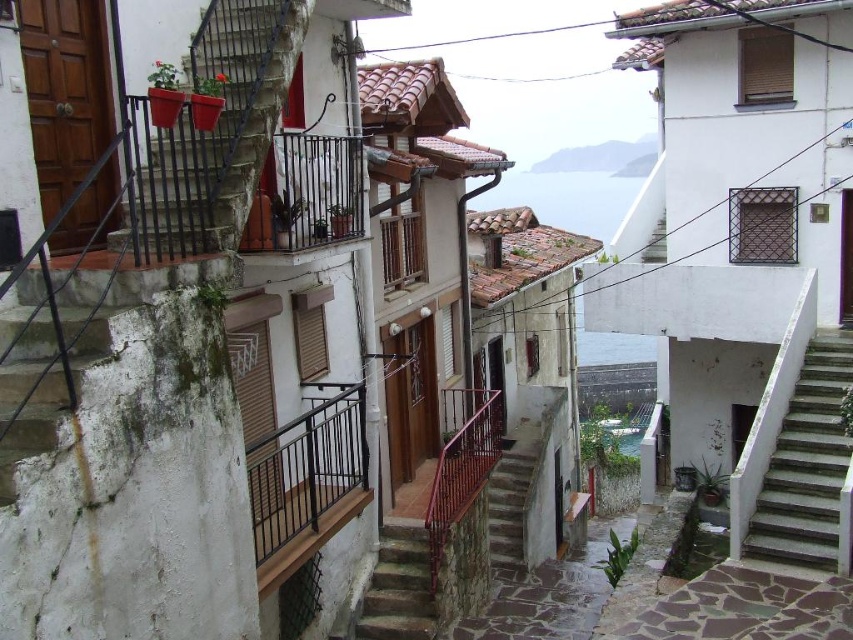
You are a painter who needs to reach the top of the rustic wood stairs at upper left. You have a ladder that is the same height as the black metal railing at center. Will your ladder be tall enough to reach the top of the stairs?

The rustic wood stairs at upper left is much taller than the black metal railing at center. Since your ladder is the same height as the railing, it will not be tall enough to reach the top of the stairs.

You are standing at the bottom of the stone textured stairs at center and want to reach the balcony above. Can you see the black metal railing at center from your current position?

Yes, the black metal railing at center is located above the stone textured stairs at center, so you can see it from your current position at the bottom of the stairs.

You are standing at the entrance of the alleyway and see two points marked in the scene. The first point is at coordinate (154, 243) and the second is at (515, 513). Which point is closer to you?

Point (154, 243) is closer to you because it is in front of point (515, 513).